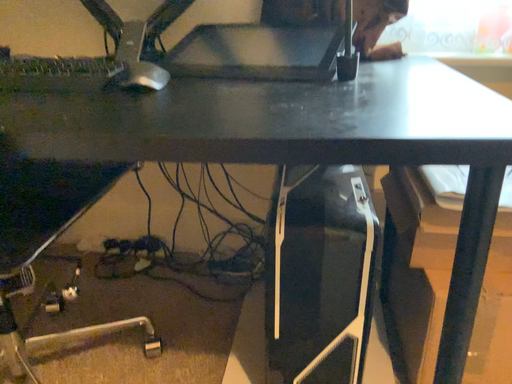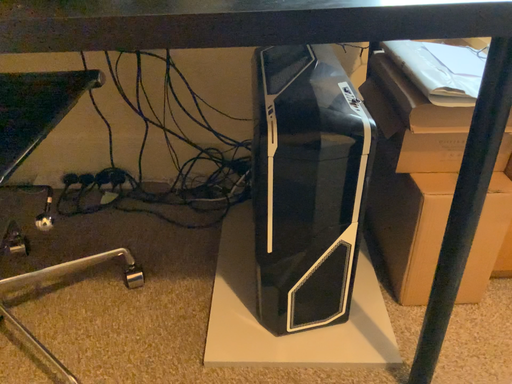
Question: Which way did the camera rotate in the video?

Choices:
 (A) rotated left
 (B) rotated right

Answer: (B)